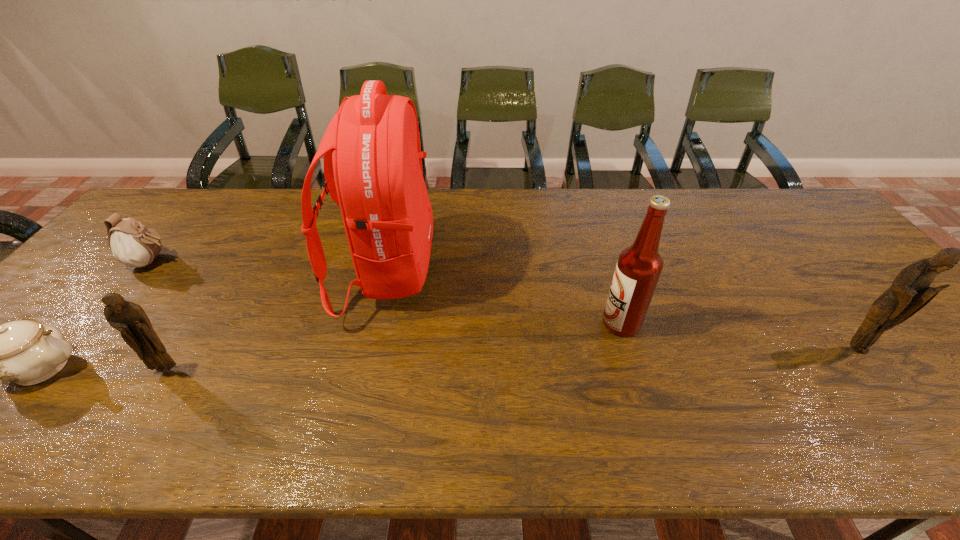
To achieve even spacing by inserting another figurine among them, please point to a vacant spot for this new figurine. Please provide its 2D coordinates. Your answer should be formatted as a tuple, i.e. [(x, y)], where the tuple contains the x and y coordinates of a point satisfying the conditions above.

[(519, 359)]